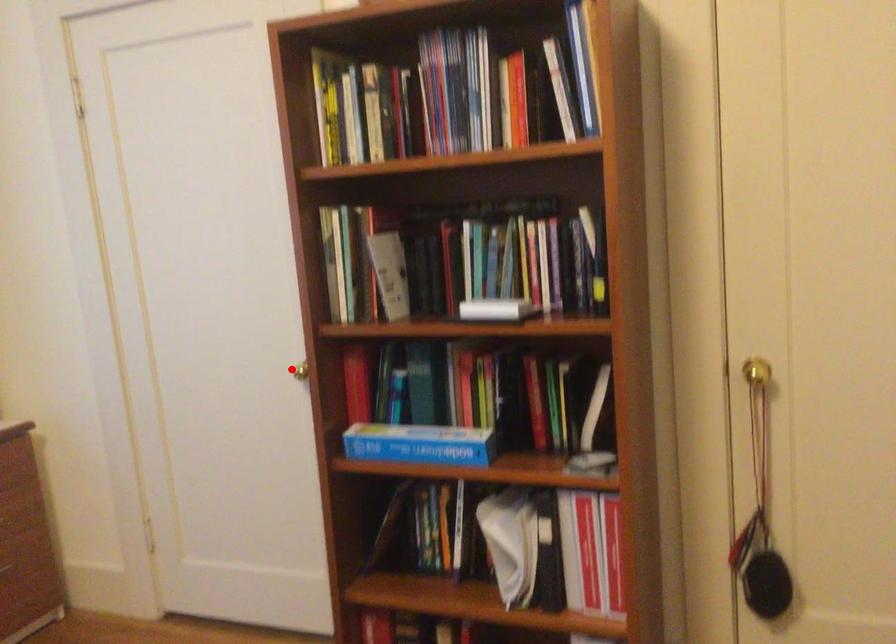
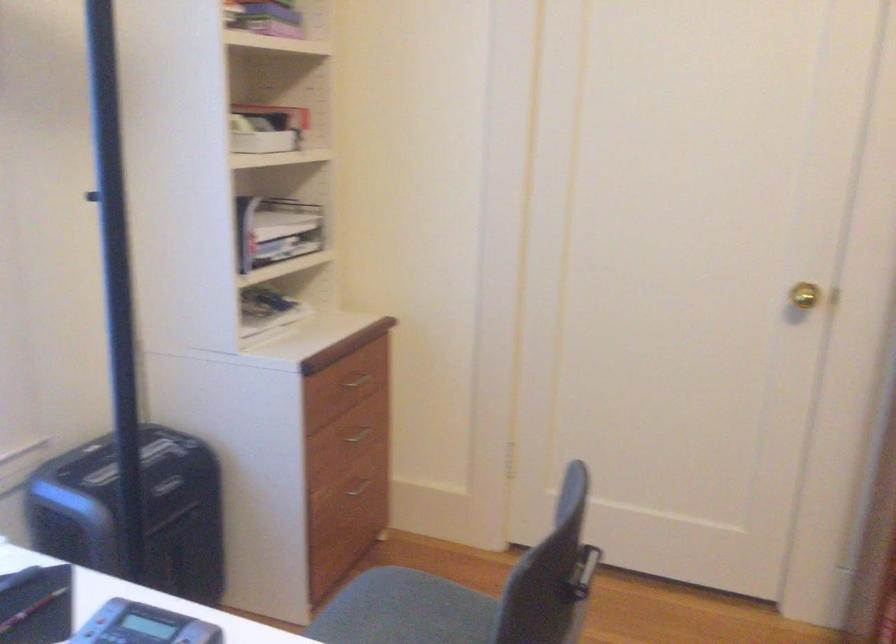
Question: I am providing you with two images of the same scene from different viewpoints. Given a red point in image1, look at the same physical point in image2. Is it:

Choices:
 (A) Closer to the viewpoint
 (B) Farther from the viewpoint

Answer: (A)